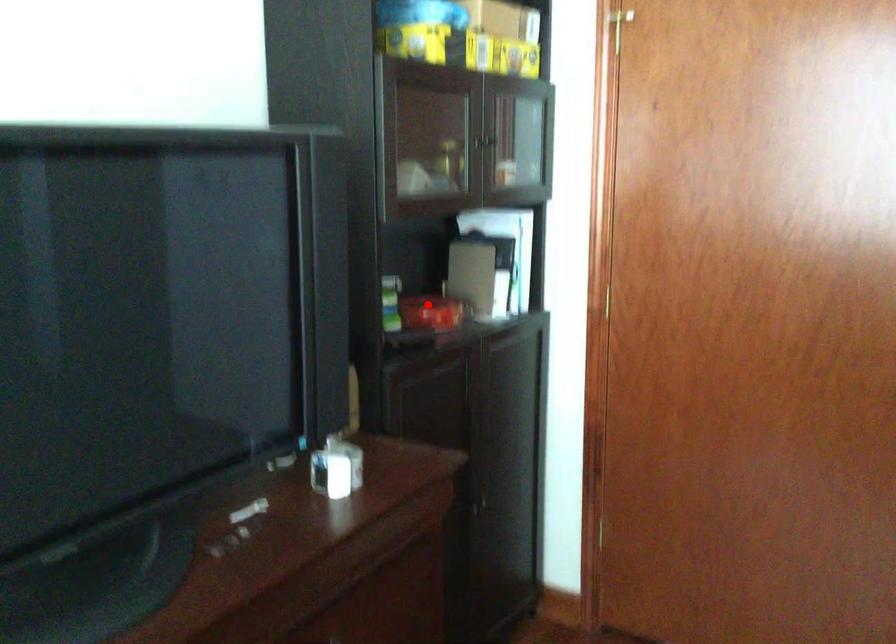
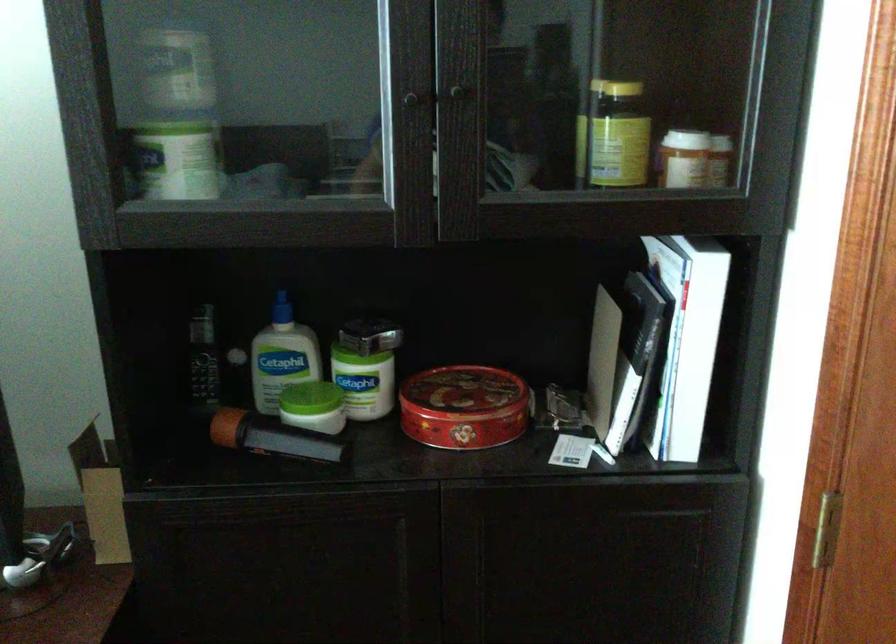
Where in the second image is the point corresponding to the highlighted location from the first image?

(462, 393)